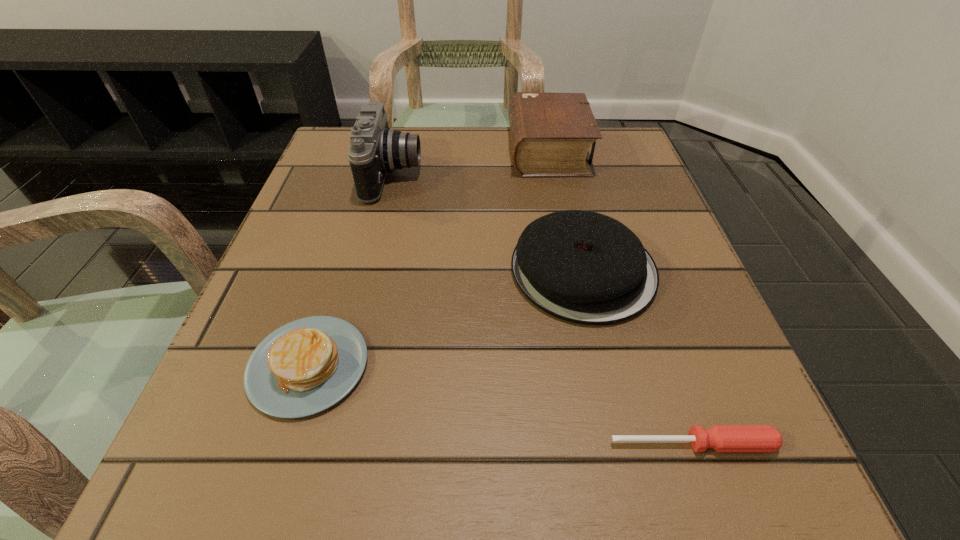
The height and width of the screenshot is (540, 960). I want to click on Bible that is at the right edge, so click(550, 133).

Where is `pancake at the right edge`? The width and height of the screenshot is (960, 540). pancake at the right edge is located at coordinates (584, 267).

Locate an element on the screen. This screenshot has height=540, width=960. screwdriver present at the right edge is located at coordinates (722, 438).

This screenshot has width=960, height=540. I want to click on object that is at the far left corner, so click(x=375, y=149).

Locate an element on the screen. object that is at the far right corner is located at coordinates (550, 133).

The height and width of the screenshot is (540, 960). Identify the location of object at the near right corner. (722, 438).

What are the coordinates of `free region at the far edge of the desktop` in the screenshot? It's located at (421, 178).

The image size is (960, 540). In the image, there is a desktop. In order to click on vacant space at the near edge in this screenshot , I will do `click(352, 477)`.

In the image, there is a desktop. Identify the location of free space at the left edge. Image resolution: width=960 pixels, height=540 pixels. (280, 257).

In the image, there is a desktop. Find the location of `vacant space at the right edge`. vacant space at the right edge is located at coordinates (704, 308).